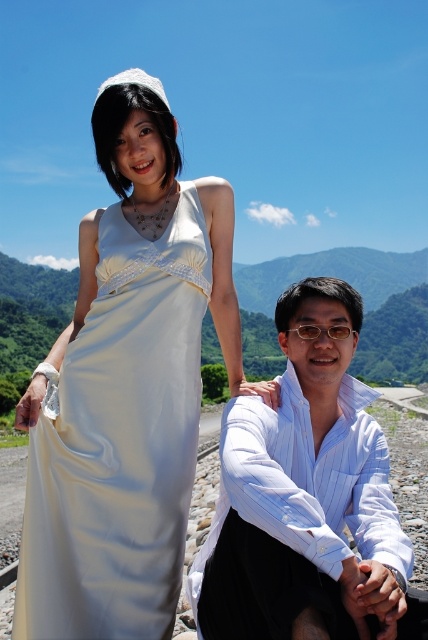
Based on the photo, you are a photographer trying to adjust the lighting for a photo shoot. You have two subjects wearing the satin white dress at center and the white striped shirt at center. The lighting equipment can only effectively illuminate objects within a 3 meter radius. Will both subjects be adequately lit if placed at their current positions?

The satin white dress at center is 3.10 meters from the white striped shirt at center. Since the distance between them exceeds the 3 meter radius of the lighting equipment, both subjects may not be adequately lit simultaneously. Adjust their positions to be closer within the 3 meter range for even illumination.

You are a photographer trying to adjust the lighting for a photo shoot. You notice the satin white dress at center and the white striped shirt at center. Which clothing item is positioned further back in the frame?

The white striped shirt at center is positioned behind the satin white dress at center, so it is further back in the frame.